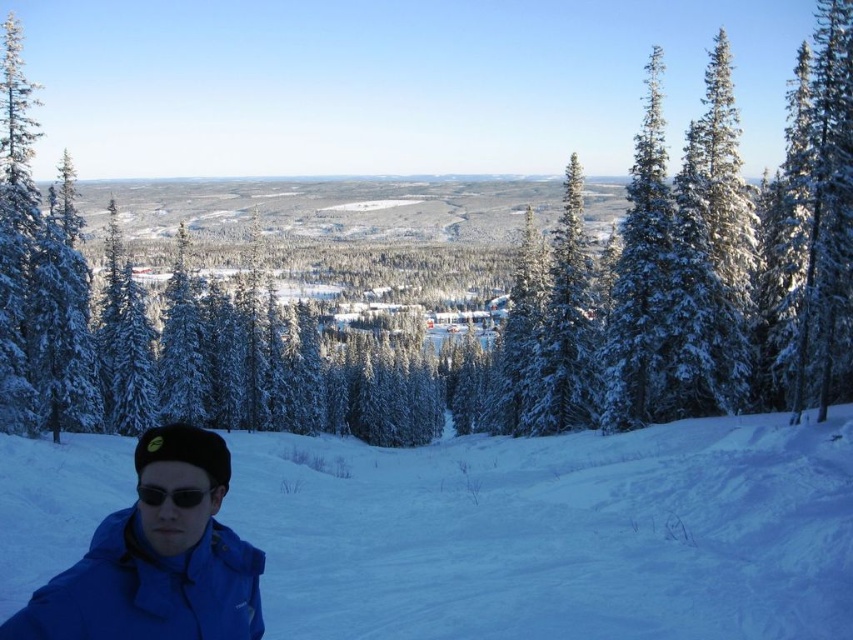
How far apart are blue matte jacket at lower left and snow-covered evergreen at right?

blue matte jacket at lower left is 48.58 meters from snow-covered evergreen at right.

Between blue matte jacket at lower left and snow-covered evergreen at right, which one has less height?

blue matte jacket at lower left is shorter.

I want to click on blue matte jacket at lower left, so click(148, 589).

Is point (543, 419) farther from viewer compared to point (193, 492)?

Yes, it is.

Does snow-covered evergreen at center have a greater height compared to black matte sunglasses at lower left?

Yes.

Does point (543, 406) come behind point (206, 492)?

Yes, it is behind point (206, 492).

You are a GUI agent. You are given a task and a screenshot of the screen. Output one action in this format:
    pyautogui.click(x=<x>, y=<y>)
    Task: Click on the snow-covered evergreen at center
    This screenshot has height=640, width=853.
    Given the screenshot: What is the action you would take?
    tap(566, 326)

Is white snow-covered tree at center positioned behind snow-covered evergreen at right?

Yes.

Between point (514, 406) and point (843, 164), which one is positioned in front?

Point (843, 164)

Image resolution: width=853 pixels, height=640 pixels. Describe the element at coordinates (488, 308) in the screenshot. I see `white snow-covered tree at center` at that location.

This screenshot has width=853, height=640. In order to click on white snow-covered tree at center in this screenshot , I will do `click(488, 308)`.